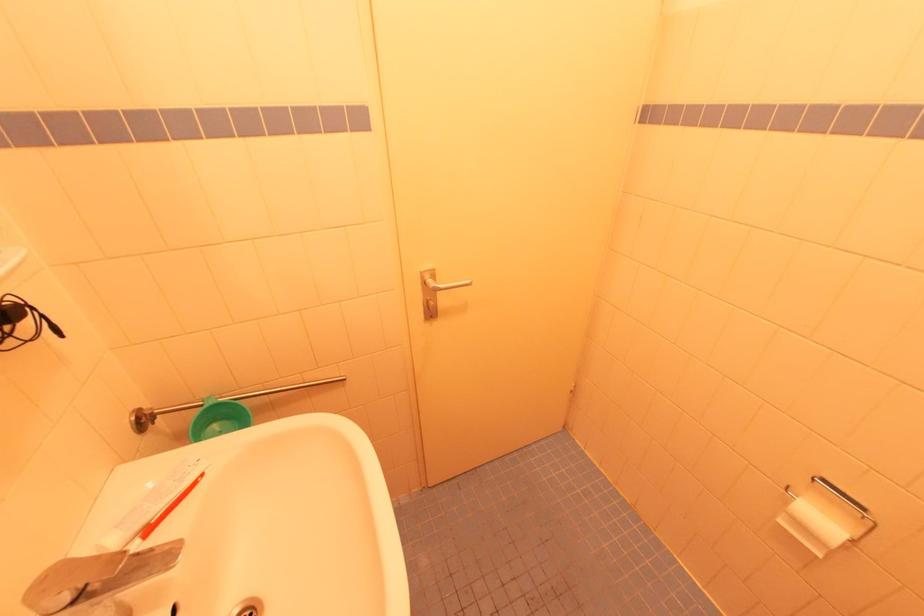
At what (x,y) coordinates should I click in order to perform the action: click on metal door handle. Please return your answer as a coordinate pair (x, y). Looking at the image, I should click on (435, 292).